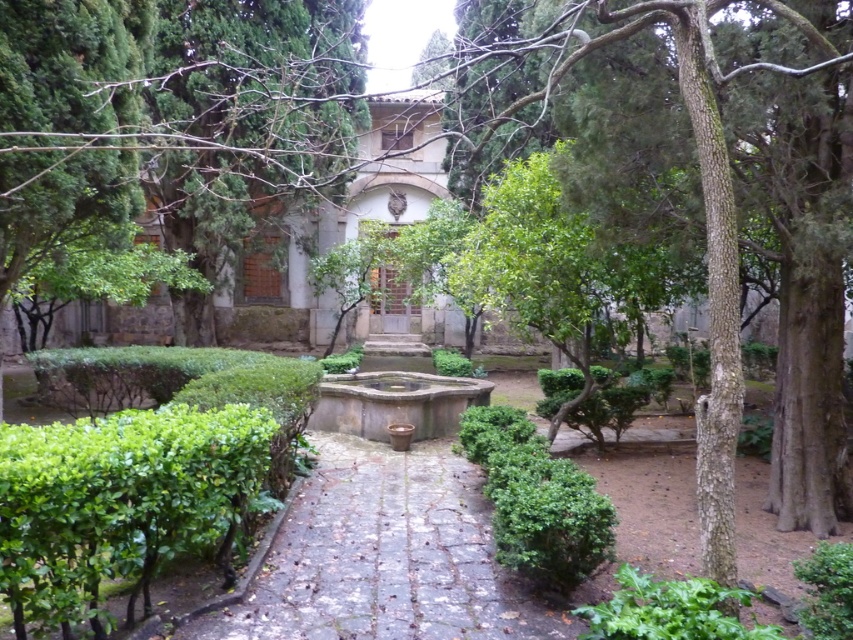
Question: Which of the following is the farthest from the observer?

Choices:
 (A) (50, 444)
 (B) (810, 13)
 (C) (407, 371)

Answer: (C)

Question: Is the position of green rough bark tree at center more distant than that of stone fountain at center?

Choices:
 (A) yes
 (B) no

Answer: (B)

Question: Which point is closer to the camera taking this photo?

Choices:
 (A) (619, 624)
 (B) (283, 618)
 (C) (172, 472)
 (D) (451, 426)

Answer: (A)

Question: Estimate the real-world distances between objects in this image. Which object is farther from the green rough bark tree at center?

Choices:
 (A) green leafy hedge at lower left
 (B) green leafy hedge at lower right
 (C) stone fountain at center

Answer: (C)

Question: Observing the image, what is the correct spatial positioning of green leafy hedge at lower left in reference to green leafy bush at lower right?

Choices:
 (A) above
 (B) below

Answer: (A)

Question: Does green stone path at center appear on the right side of stone fountain at center?

Choices:
 (A) no
 (B) yes

Answer: (B)